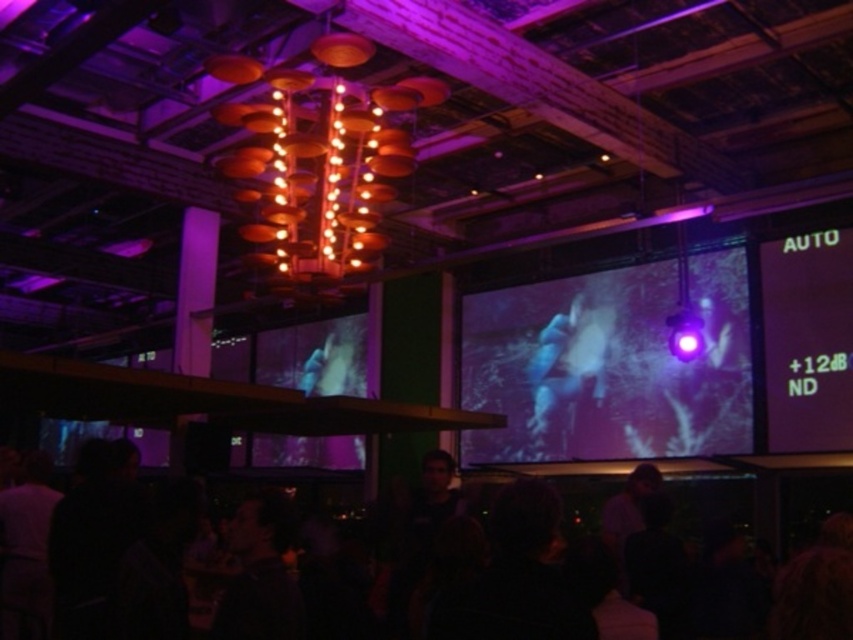
Question: Can you confirm if green matte projection screen at upper right is bigger than blue fabric person at center?

Choices:
 (A) no
 (B) yes

Answer: (A)

Question: Which of the following is the closest to the observer?

Choices:
 (A) black matte crowd at lower center
 (B) matte black screen at center
 (C) blue fabric person at center
 (D) green matte projection screen at upper right

Answer: (A)

Question: Is the position of matte black screen at center more distant than that of black matte crowd at lower center?

Choices:
 (A) no
 (B) yes

Answer: (B)

Question: Where is matte black screen at center located in relation to green matte projection screen at upper right in the image?

Choices:
 (A) above
 (B) below

Answer: (B)

Question: Which is nearer to the black matte crowd at lower center?

Choices:
 (A) matte black screen at center
 (B) blue fabric person at center
 (C) green matte projection screen at upper right

Answer: (A)

Question: Considering the real-world distances, which object is closest to the green matte projection screen at upper right?

Choices:
 (A) blue fabric person at center
 (B) black matte crowd at lower center

Answer: (A)